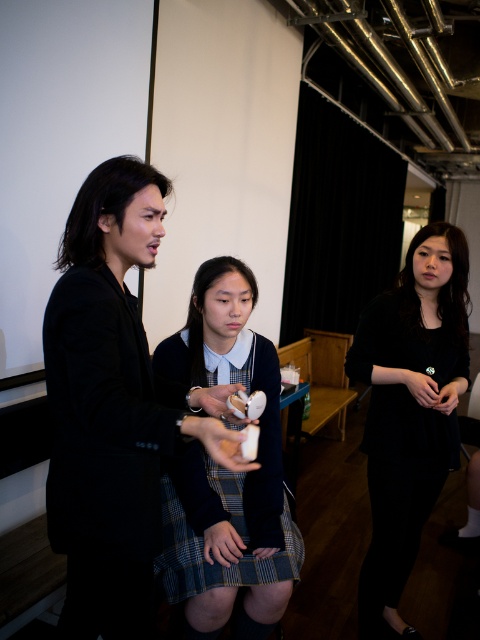
Between plaid skirt at center and black matte dress at right, which one is positioned lower?

Positioned lower is black matte dress at right.

Which is more to the left, plaid skirt at center or black matte dress at right?

plaid skirt at center is more to the left.

Who is more forward, (x=109, y=180) or (x=408, y=394)?

Point (x=109, y=180)

This screenshot has height=640, width=480. I want to click on plaid skirt at center, so click(x=113, y=406).

Is point (162, 358) positioned behind point (412, 284)?

No.

Can you confirm if matte white controller at center is positioned to the right of black matte dress at right?

In fact, matte white controller at center is to the left of black matte dress at right.

I want to click on matte white controller at center, so click(x=227, y=472).

Can you confirm if plaid skirt at center is smaller than matte white controller at center?

No.

Does plaid skirt at center appear over matte white controller at center?

Indeed, plaid skirt at center is positioned over matte white controller at center.

This screenshot has height=640, width=480. Describe the element at coordinates (113, 406) in the screenshot. I see `plaid skirt at center` at that location.

Locate an element on the screen. The image size is (480, 640). plaid skirt at center is located at coordinates (113, 406).